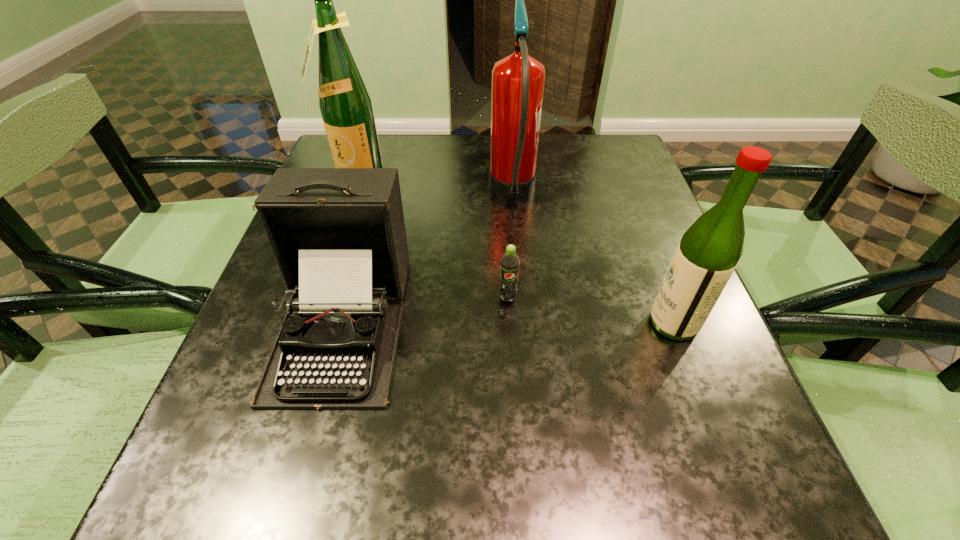
At what (x,y) coordinates should I click in order to perform the action: click on free space between the rightmost object and the soda. Please return your answer as a coordinate pair (x, y). Image resolution: width=960 pixels, height=540 pixels. Looking at the image, I should click on (590, 310).

I want to click on free space that is in between the shortest object and the fourth tallest object, so click(425, 310).

Where is `free spot between the shortest object and the farther liquor`? The width and height of the screenshot is (960, 540). free spot between the shortest object and the farther liquor is located at coordinates (432, 238).

I want to click on unoccupied area between the fire extinguisher and the rightmost object, so click(x=593, y=258).

Select which object appears as the second closest to the taller liquor. Please provide its 2D coordinates. Your answer should be formatted as a tuple, i.e. [(x, y)], where the tuple contains the x and y coordinates of a point satisfying the conditions above.

[(518, 79)]

At what (x,y) coordinates should I click in order to perform the action: click on object identified as the second closest to the soda. Please return your answer as a coordinate pair (x, y). The height and width of the screenshot is (540, 960). Looking at the image, I should click on (518, 79).

The height and width of the screenshot is (540, 960). Find the location of `vacant position in the image that satisfies the following two spatial constraints: 1. on the front-facing side of the left liquor; 2. on the right side of the fire extinguisher`. vacant position in the image that satisfies the following two spatial constraints: 1. on the front-facing side of the left liquor; 2. on the right side of the fire extinguisher is located at coordinates (350, 192).

Where is `free location that satisfies the following two spatial constraints: 1. on the front-facing side of the taller liquor; 2. on the right side of the fire extinguisher`? This screenshot has height=540, width=960. free location that satisfies the following two spatial constraints: 1. on the front-facing side of the taller liquor; 2. on the right side of the fire extinguisher is located at coordinates (350, 192).